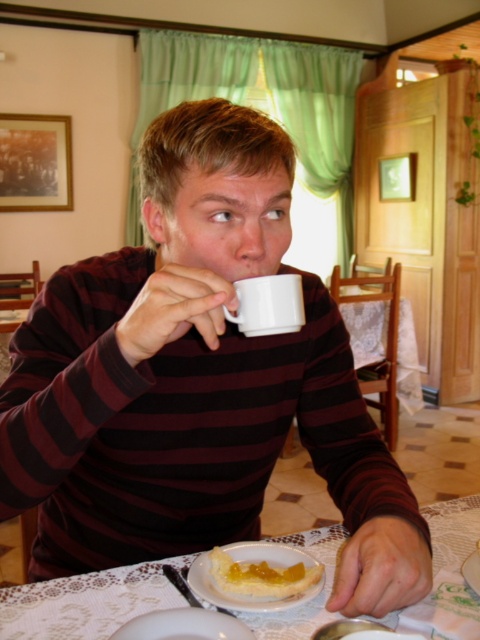
Does white lace tablecloth at lower center appear under white glossy plate at lower center?

Yes, white lace tablecloth at lower center is below white glossy plate at lower center.

Who is more distant from viewer, (120, 572) or (242, 621)?

Point (120, 572)

Locate an element on the screen. The width and height of the screenshot is (480, 640). white lace tablecloth at lower center is located at coordinates (85, 602).

Which of these two, white glossy mug at upper center or white glossy plate at lower center, stands shorter?

With less height is white glossy plate at lower center.

Can you confirm if white glossy mug at upper center is smaller than white glossy plate at lower center?

No, white glossy mug at upper center is not smaller than white glossy plate at lower center.

Is point (168, 497) in front of point (170, 616)?

No.

Identify the location of white glossy mug at upper center. (195, 381).

Does yellow custard tart at lower center have a larger size compared to white glossy plate at lower center?

Yes.

What do you see at coordinates (262, 577) in the screenshot? Image resolution: width=480 pixels, height=640 pixels. I see `yellow custard tart at lower center` at bounding box center [262, 577].

I want to click on yellow custard tart at lower center, so click(x=262, y=577).